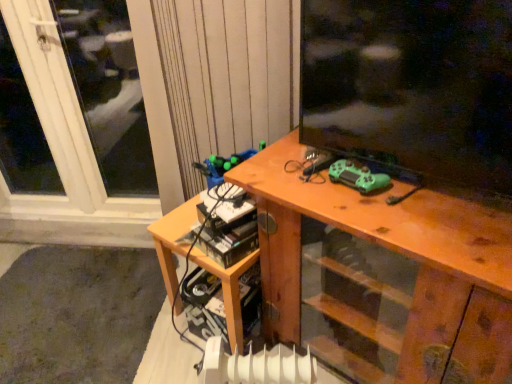
This screenshot has height=384, width=512. What are the coordinates of `free space in front of matte black tv at upper right` in the screenshot? It's located at (423, 218).